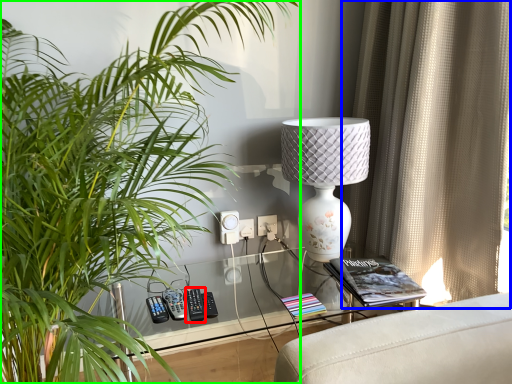
Question: Which is nearer to the control (highlighted by a red box)? curtain (highlighted by a blue box) or houseplant (highlighted by a green box).

Choices:
 (A) curtain
 (B) houseplant

Answer: (B)